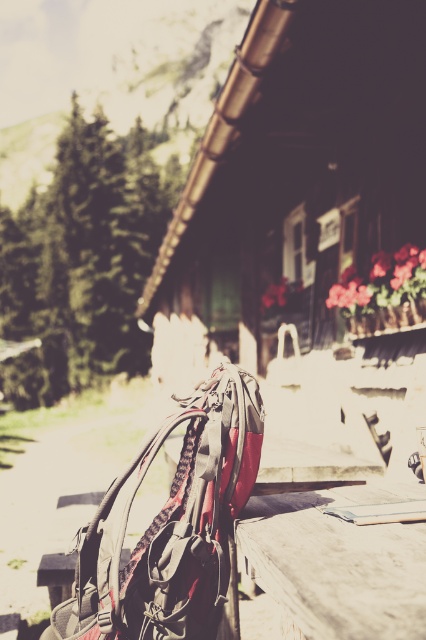
You are planning to place a large potted plant between the wooden cabin at center and the wooden table at center. Based on their positions, which object should the plant be closer to?

The wooden table at center is behind the wooden cabin at center, so the plant should be placed closer to the wooden cabin at center to be between them.

You are hiking and come across the wooden cabin at center and the green textured pine at left. Which object is positioned to the left side of the other?

The wooden cabin at center is to the right of green textured pine at left, so the green textured pine at left is positioned to the left side of the wooden cabin at center.

Based on the photo, you are a hiker who has just arrived at the wooden cabin at center and the matte black backpack at center. You need to place your gear on the table near the backpack. Which object is closer to the ground?

The matte black backpack at center is closer to the ground because it is located below the wooden cabin at center.